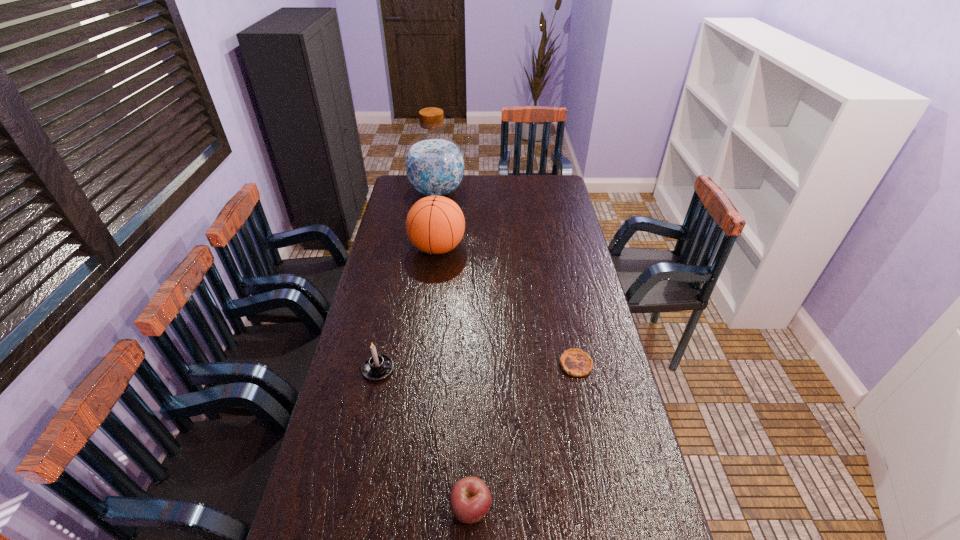
Find the location of a particular element. The width and height of the screenshot is (960, 540). vacant space located 0.380m on the front of the fourth shortest object is located at coordinates (427, 333).

Locate an element on the screen. This screenshot has width=960, height=540. free space located 0.300m with a handle on the side of the candle holder is located at coordinates (485, 369).

Find the location of a particular element. The height and width of the screenshot is (540, 960). vacant space positioned 0.050m on the right of the shortest object is located at coordinates (607, 364).

Locate an element on the screen. The height and width of the screenshot is (540, 960). object located in the far edge section of the desktop is located at coordinates (434, 165).

Locate an element on the screen. The height and width of the screenshot is (540, 960). water jug present at the left edge is located at coordinates (434, 165).

Where is `basketball located at the left edge`? The image size is (960, 540). basketball located at the left edge is located at coordinates (435, 224).

I want to click on candle holder present at the left edge, so click(x=377, y=367).

In order to click on object positioned at the right edge in this screenshot , I will do `click(575, 362)`.

This screenshot has width=960, height=540. Find the location of `object located at the far left corner`. object located at the far left corner is located at coordinates (434, 165).

Where is `free space at the left edge of the desktop`? The width and height of the screenshot is (960, 540). free space at the left edge of the desktop is located at coordinates (387, 288).